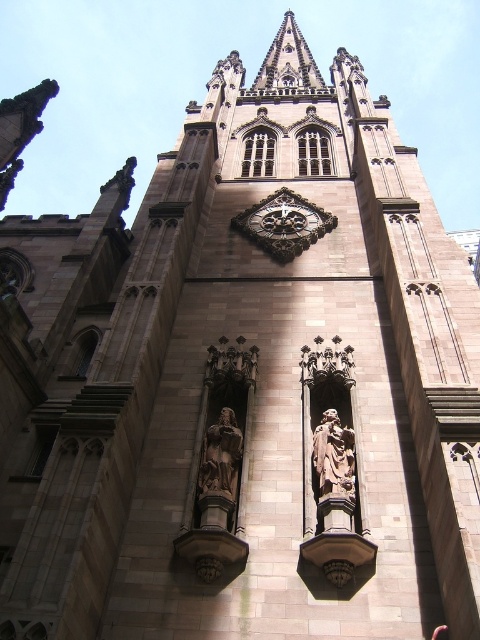
Based on the scene description, where is the gold ornate clock at center located in terms of coordinates?

The gold ornate clock at center is located at coordinates point (284,224).

You are standing at the camera position and want to take a photo of the polished bronze statue at center. The statue is 44.26 meters away. Your camera has a maximum zoom range of 50 meters. Can you capture the statue clearly in your photo?

The polished bronze statue at center is 44.26 meters away from the camera, which is within the camera maximum zoom range of 50 meters. Yes, you can capture the statue clearly in your photo.

Consider the image. You are standing in front of the Gothic cathedral and want to take a closer look at both the gold ornate clock at center and the polished bronze statue at center. Which object should you approach first to reach the one closer to you?

You should approach the gold ornate clock at center first because it is closer to you than the polished bronze statue at center.